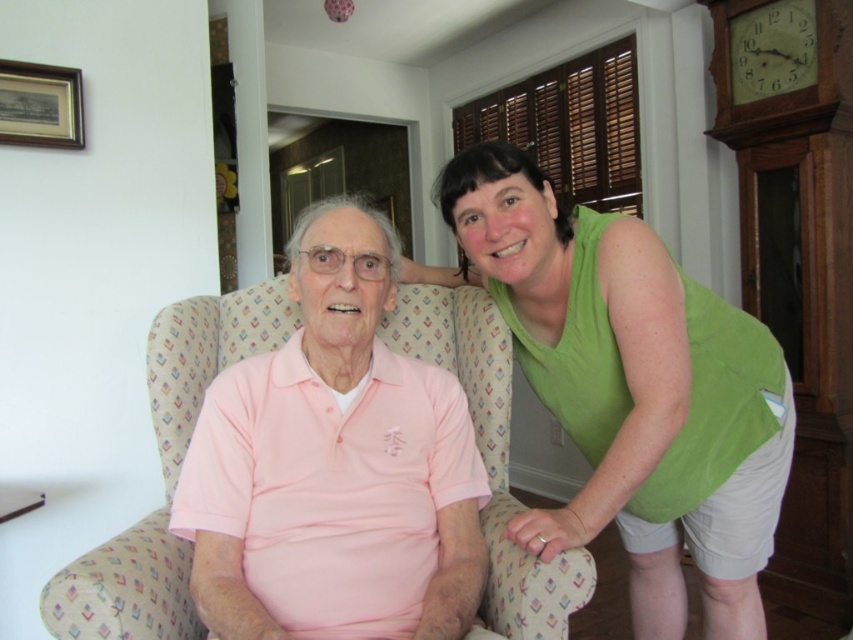
You are standing in the living room and want to place a small potted plant between the two points labeled point (518, 561) and point (734, 54). Which point should the plant be closer to so it is positioned in front of the other point?

The plant should be placed closer to point (518, 561) because it is in front of point .086, 0.862.

You are taking a photo of the wooden clock at upper right and the green sleeveless top at upper right. Which object will appear larger in the photo?

The green sleeveless top at upper right will appear larger in the photo because it is closer to the viewer than the wooden clock at upper right.

You are a photographer trying to capture a photo of both the green sleeveless top at upper right and the pink fabric armchair at center in the same frame. Based on their positions, which object should you focus on first to ensure both are in focus?

The green sleeveless top at upper right is much taller than the pink fabric armchair at center, so you should focus on the green sleeveless top at upper right first to ensure both are in focus.